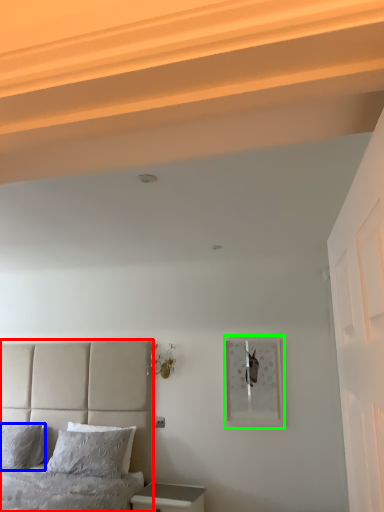
Question: Based on their relative distances, which object is farther from bed (highlighted by a red box)? Choose from pillow (highlighted by a blue box) and picture frame (highlighted by a green box).

Choices:
 (A) pillow
 (B) picture frame

Answer: (B)